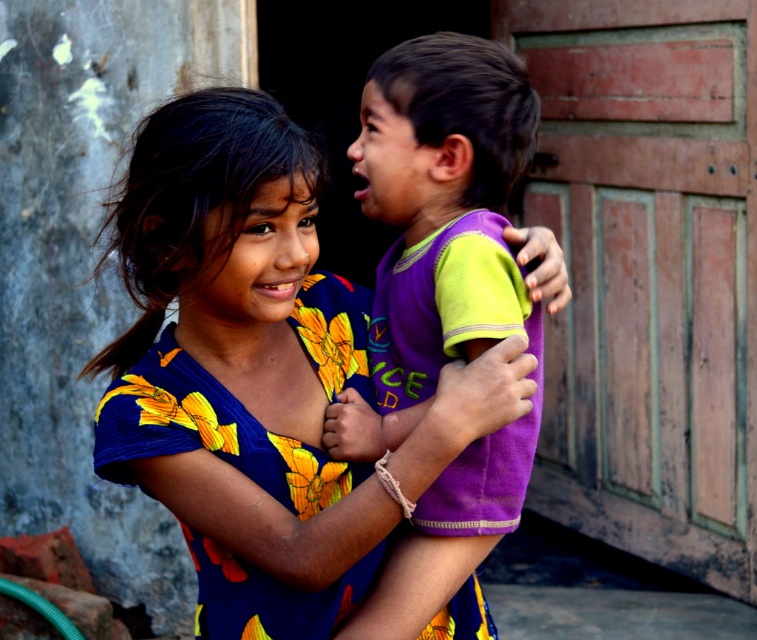
You are a photographer trying to capture a candid shot of the two children in the scene. You want to position yourself so that the floral fabric dress at center is visible to the left of the purple soft fabric shirt at center in the frame. Is this possible given their current positions?

Yes, because the floral fabric dress at center is already positioned to the left of the purple soft fabric shirt at center, so arranging the camera to capture them in this orientation is feasible.

You are a photographer trying to capture the children in the image. You need to adjust your camera to focus on the floral fabric dress at center and the purple soft fabric shirt at center. Which one should you focus on first if you want to ensure both are in focus without moving the camera?

The floral fabric dress at center is located below the purple soft fabric shirt at center. To ensure both are in focus, focus on the purple soft fabric shirt at center first since it is farther away, then adjust the focus to include the closer floral fabric dress at center.

You are a photographer trying to capture the floral fabric dress at center in your shot. The camera is positioned at point A, and you can move it left or right along the horizontal axis. Based on the coordinates provided, should you move the camera to the left or right to center the dress in your frame?

The floral fabric dress at center is located at point 0.573 on the horizontal axis. Since the center of the frame is at 0.5, you should move the camera slightly to the right to bring the dress into the center of the frame.